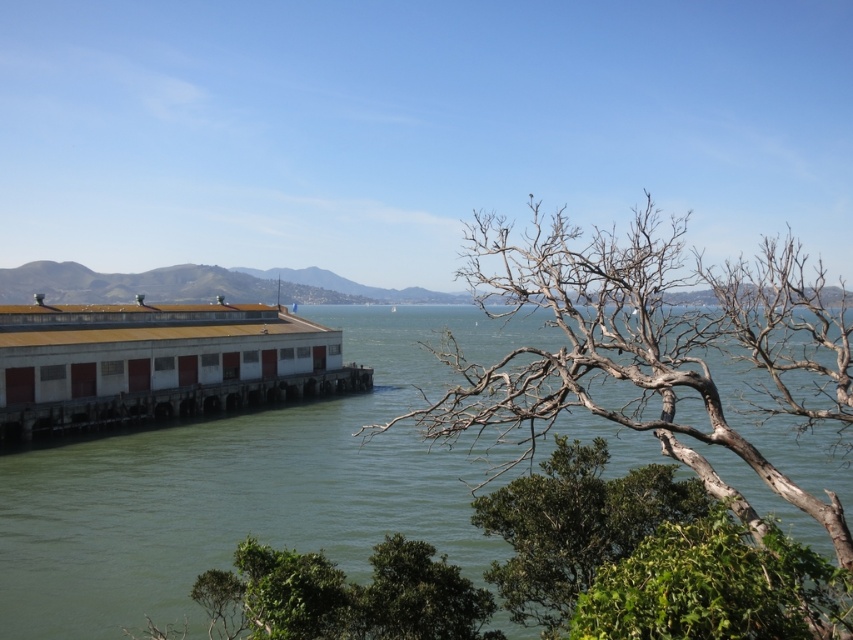
You are standing at the center of the image. Which direction should you look to see the green water at lower left?

The green water at lower left is located at point (x=248, y=484), so you should look to the lower left direction to see it.

You are a boat captain trying to dock your vessel at the white matte dock at lower left. The green water at lower left is part of the channel you must navigate. Based on the scene, can you safely dock here considering the water level relative to the dock?

The green water at lower left has a greater height compared to the white matte dock at lower left, meaning the water level is higher than the dock. This suggests that docking might be possible as the water reaches the dock level, but caution is needed due to potential strong currents or tidal effects in the area described.